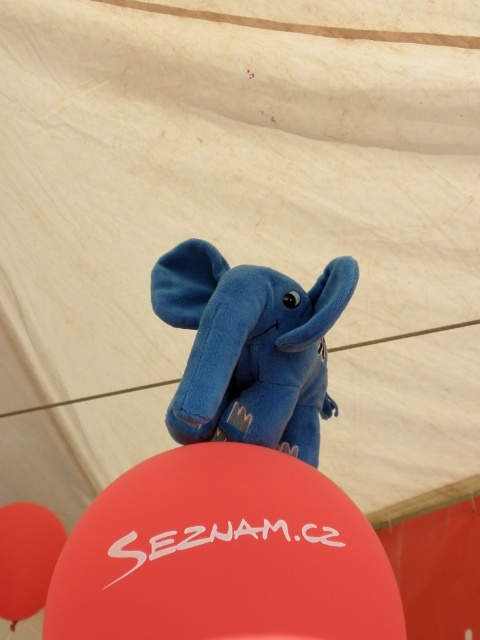
You are planning to hang a decoration that requires knowing which balloon is shorter. You see a rubber balloon at center and a smooth red balloon at lower left. Which one is shorter?

The rubber balloon at center is shorter than the smooth red balloon at lower left because it is not as tall.

You are trying to determine the distance between the blue plush toy elephant and the rubber balloon at center. According to the image, how far apart are they?

The blue plush toy elephant and the rubber balloon at center are 77.23 centimeters apart.